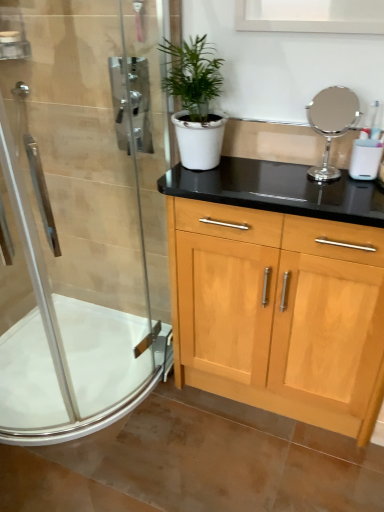
The image size is (384, 512). In order to click on free space in front of clear glass shower door at left in this screenshot , I will do `click(147, 458)`.